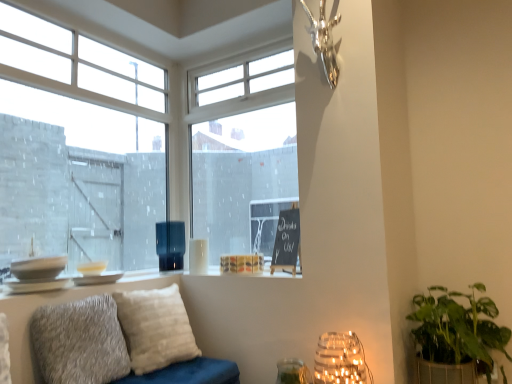
This screenshot has height=384, width=512. I want to click on black chalkboard at center, so click(x=286, y=241).

Where is `white textured pillow at center, the 2th pillow from the front`? The height and width of the screenshot is (384, 512). white textured pillow at center, the 2th pillow from the front is located at coordinates (155, 328).

Image resolution: width=512 pixels, height=384 pixels. What do you see at coordinates (340, 360) in the screenshot?
I see `illuminated glass jar at lower right, the 1th lamp in the bottom-to-top sequence` at bounding box center [340, 360].

The width and height of the screenshot is (512, 384). Find the location of `fuzzy gray pillow at lower left, which is the first pillow in front-to-back order`. fuzzy gray pillow at lower left, which is the first pillow in front-to-back order is located at coordinates (80, 342).

You are a GUI agent. You are given a task and a screenshot of the screen. Output one action in this format:
    pyautogui.click(x=<x>, y=<y>)
    Task: Click on the black chalkboard at center
    
    Given the screenshot: What is the action you would take?
    pyautogui.click(x=286, y=241)

Considering the relative sizes of transparent glass window at center, the first window positioned from the right, and black chalkboard at center in the image provided, is transparent glass window at center, the first window positioned from the right, shorter than black chalkboard at center?

In fact, transparent glass window at center, the first window positioned from the right, may be taller than black chalkboard at center.

Can you confirm if transparent glass window at center, the first window positioned from the right, is thinner than black chalkboard at center?

Indeed, transparent glass window at center, the first window positioned from the right, has a lesser width compared to black chalkboard at center.

Considering the relative positions of transparent glass window at center, which is the second window in left-to-right order, and black chalkboard at center in the image provided, is transparent glass window at center, which is the second window in left-to-right order, in front of black chalkboard at center?

No, transparent glass window at center, which is the second window in left-to-right order, is further to the viewer.

Where is `the 1st window to the left when counting from the black chalkboard at center`? Image resolution: width=512 pixels, height=384 pixels. the 1st window to the left when counting from the black chalkboard at center is located at coordinates (244, 156).

Can you confirm if black chalkboard at center is positioned to the left of white textured pillow at center, the first pillow in the back-to-front sequence?

No, black chalkboard at center is not to the left of white textured pillow at center, the first pillow in the back-to-front sequence.

Choose the correct answer: Is black chalkboard at center inside white textured pillow at center, the 2th pillow from the front, or outside it?

black chalkboard at center exists outside the volume of white textured pillow at center, the 2th pillow from the front.

I want to click on the 1st pillow in front of the black chalkboard at center, starting your count from the anchor, so click(x=155, y=328).

Based on the photo, is clear glass vase at lower center not within matte black vase at center, which is counted as the first lamp, starting from the left?

Indeed, clear glass vase at lower center is completely outside matte black vase at center, which is counted as the first lamp, starting from the left.

Considering the sizes of objects clear glass vase at lower center and matte black vase at center, the 1th lamp positioned from the back, in the image provided, who is smaller, clear glass vase at lower center or matte black vase at center, the 1th lamp positioned from the back,?

Smaller between the two is clear glass vase at lower center.

From a real-world perspective, who is located higher, clear glass vase at lower center or matte black vase at center, the 2th lamp when ordered from bottom to top?

matte black vase at center, the 2th lamp when ordered from bottom to top, is physically above.

Considering the sizes of objects clear glass vase at lower center and matte black vase at center, the 2th lamp when ordered from bottom to top, in the image provided, who is taller, clear glass vase at lower center or matte black vase at center, the 2th lamp when ordered from bottom to top,?

With more height is matte black vase at center, the 2th lamp when ordered from bottom to top.

How many degrees apart are the facing directions of clear glass vase at lower center and clear glass window at upper left, which is counted as the 1th window, starting from the left?

There is a 89.9-degree angle between the facing directions of clear glass vase at lower center and clear glass window at upper left, which is counted as the 1th window, starting from the left.

Is clear glass window at upper left, acting as the second window starting from the right, at the back of clear glass vase at lower center?

clear glass vase at lower center does not have its back to clear glass window at upper left, acting as the second window starting from the right.

Between clear glass vase at lower center and clear glass window at upper left, acting as the second window starting from the right, which one has larger width?

clear glass vase at lower center.

Between black chalkboard at center and fuzzy gray pillow at lower left, which is the first pillow in front-to-back order, which one has less height?

With less height is fuzzy gray pillow at lower left, which is the first pillow in front-to-back order.

Between black chalkboard at center and fuzzy gray pillow at lower left, which is the first pillow in front-to-back order, which one has smaller width?

Thinner between the two is black chalkboard at center.

Based on the photo, could you measure the distance between black chalkboard at center and fuzzy gray pillow at lower left, which is the first pillow in front-to-back order?

black chalkboard at center and fuzzy gray pillow at lower left, which is the first pillow in front-to-back order, are 90.48 centimeters apart.

From a real-world perspective, which is physically below, black chalkboard at center or fuzzy gray pillow at lower left, acting as the 2th pillow starting from the back?

In real-world perspective, fuzzy gray pillow at lower left, acting as the 2th pillow starting from the back, is lower.

Is transparent glass window at center, which is the second window in left-to-right order, turned away from green leafy plant in woven basket at lower right?

No, transparent glass window at center, which is the second window in left-to-right order, is not facing the opposite direction of green leafy plant in woven basket at lower right.

Looking at this image, considering the relative sizes of transparent glass window at center, which is the second window in left-to-right order, and green leafy plant in woven basket at lower right in the image provided, is transparent glass window at center, which is the second window in left-to-right order, bigger than green leafy plant in woven basket at lower right?

Indeed, transparent glass window at center, which is the second window in left-to-right order, has a larger size compared to green leafy plant in woven basket at lower right.

Between transparent glass window at center, the first window positioned from the right, and green leafy plant in woven basket at lower right, which one has smaller width?

transparent glass window at center, the first window positioned from the right, is thinner.

Is clear glass vase at lower center looking in the opposite direction of illuminated glass jar at lower right, the first lamp from the front?

No, clear glass vase at lower center is not facing the opposite direction of illuminated glass jar at lower right, the first lamp from the front.

From the image's perspective, is clear glass vase at lower center above illuminated glass jar at lower right, the first lamp in the right-to-left sequence?

No, from the image's perspective, clear glass vase at lower center is not above illuminated glass jar at lower right, the first lamp in the right-to-left sequence.

Which of these two, clear glass vase at lower center or illuminated glass jar at lower right, the first lamp from the front, is smaller?

With smaller size is clear glass vase at lower center.

Consider the image. Between clear glass vase at lower center and illuminated glass jar at lower right, the second lamp when ordered from left to right, which one has smaller width?

clear glass vase at lower center is thinner.

From a real-world perspective, starting from the black chalkboard at center, which window is the 2nd one vertically above it? Please provide its 2D coordinates.

[(244, 156)]

Locate an element on the screen. This screenshot has width=512, height=384. bulletin board that appears on the right of white textured pillow at center, the first pillow in the back-to-front sequence is located at coordinates (286, 241).

In the scene shown: Which object lies nearer to the anchor point matte black vase at center, the 2th lamp when ordered from bottom to top, clear glass window at upper left, acting as the second window starting from the right, or fuzzy gray pillow at lower left, which is the first pillow in front-to-back order?

Among the two, clear glass window at upper left, acting as the second window starting from the right, is located nearer to matte black vase at center, the 2th lamp when ordered from bottom to top.

Which object lies further to the anchor point green leafy plant in woven basket at lower right, matte black vase at center, the second lamp viewed from the front, or black chalkboard at center?

The object further to green leafy plant in woven basket at lower right is matte black vase at center, the second lamp viewed from the front.

Estimate the real-world distances between objects in this image. Which object is further from black chalkboard at center, clear glass vase at lower center or matte black vase at center, which is counted as the first lamp, starting from the left?

matte black vase at center, which is counted as the first lamp, starting from the left, is further to black chalkboard at center.

Which object lies further to the anchor point matte black vase at center, the second lamp viewed from the front, black chalkboard at center or clear glass vase at lower center?

Based on the image, clear glass vase at lower center appears to be further to matte black vase at center, the second lamp viewed from the front.

From the image, which object appears to be nearer to white textured pillow at center, the 2th pillow from the front, black chalkboard at center or illuminated glass jar at lower right, which is counted as the second lamp, starting from the top?

Based on the image, black chalkboard at center appears to be nearer to white textured pillow at center, the 2th pillow from the front.

From the image, which object appears to be nearer to green leafy plant in woven basket at lower right, white textured pillow at center, the 2th pillow from the front, or transparent glass window at center, the first window positioned from the right?

The object closer to green leafy plant in woven basket at lower right is white textured pillow at center, the 2th pillow from the front.

Consider the image. Considering their positions, is matte black vase at center, the 1th lamp positioned from the back, positioned further to transparent glass window at center, the first window positioned from the right, than clear glass window at upper left, acting as the second window starting from the right?

matte black vase at center, the 1th lamp positioned from the back, lies further to transparent glass window at center, the first window positioned from the right, than the other object.

Looking at the image, which one is located further to black chalkboard at center, clear glass vase at lower center or illuminated glass jar at lower right, the second lamp from the back?

The object further to black chalkboard at center is clear glass vase at lower center.

Locate an element on the screen. This screenshot has height=384, width=512. window between transparent glass window at center, the first window positioned from the right, and fuzzy gray pillow at lower left, which is the first pillow in front-to-back order, in the up-down direction is located at coordinates (128, 143).

I want to click on bulletin board between transparent glass window at center, the first window positioned from the right, and green leafy plant in woven basket at lower right from left to right, so click(x=286, y=241).

Locate an element on the screen. lamp between clear glass window at upper left, which is counted as the 1th window, starting from the left, and black chalkboard at center is located at coordinates (x=170, y=244).

Find the location of `glass vase situated between fuzzy gray pillow at lower left, acting as the 2th pillow starting from the back, and illuminated glass jar at lower right, the 1th lamp in the bottom-to-top sequence, from left to right`. glass vase situated between fuzzy gray pillow at lower left, acting as the 2th pillow starting from the back, and illuminated glass jar at lower right, the 1th lamp in the bottom-to-top sequence, from left to right is located at coordinates (293, 372).